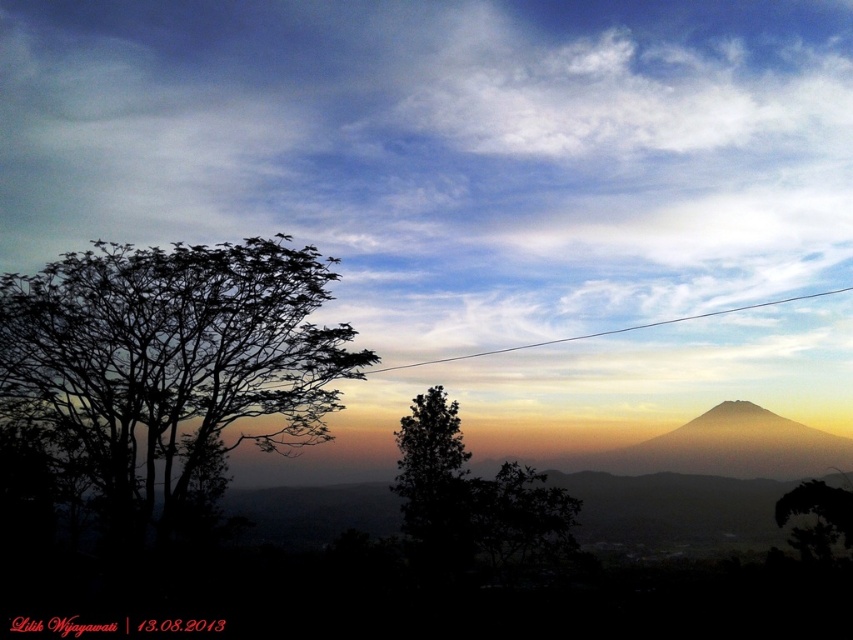
Question: Can you confirm if green matte tree at center is wider than green leafy tree at center?

Choices:
 (A) yes
 (B) no

Answer: (B)

Question: Among these objects, which one is nearest to the camera?

Choices:
 (A) green leafy tree at center
 (B) green matte tree at lower right

Answer: (B)

Question: Which of the following is the closest to the observer?

Choices:
 (A) white wire at upper center
 (B) green leafy tree at center

Answer: (B)

Question: Considering the real-world distances, which object is closest to the green matte tree at lower right?

Choices:
 (A) silhouette leafy tree at left
 (B) smokey yellow mountain at right
 (C) white fluffy cloud at upper center

Answer: (B)

Question: Can you confirm if smokey yellow mountain at right is smaller than green leafy tree at center?

Choices:
 (A) no
 (B) yes

Answer: (A)

Question: Is green matte tree at center behind white wire at upper center?

Choices:
 (A) yes
 (B) no

Answer: (B)